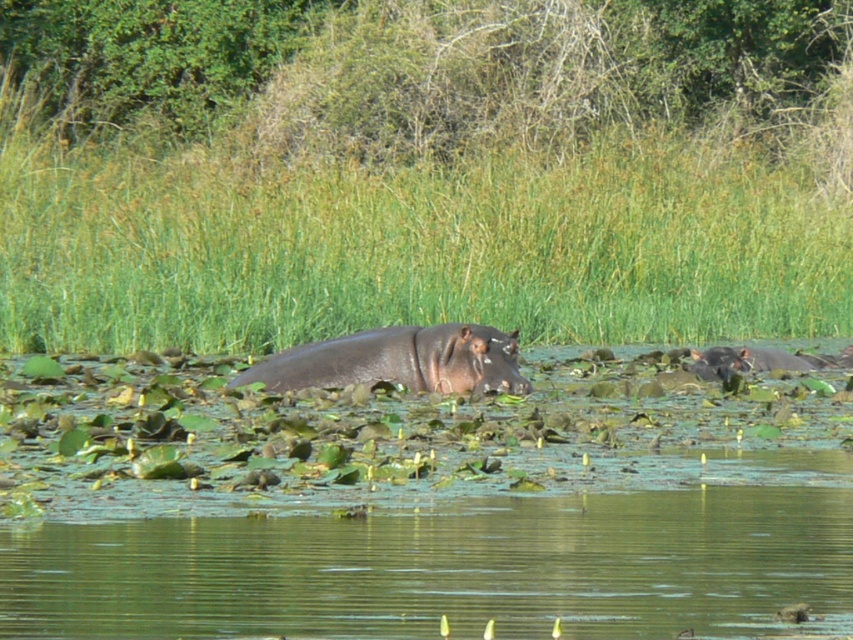
You are a photographer trying to capture the green grass at center and the sleek dark brown hippo at center in a single shot. Considering their sizes, which one will occupy more space in your photo?

The green grass at center has a larger size compared to the sleek dark brown hippo at center, so it will occupy more space in the photo.

You are a drone operator flying over a natural reserve. Your drone is currently at the point marked by point (447,568). You need to hover above the greenish water at center. Is your current position correct?

Yes, the point (447,568) marks greenish water at center, so the drone is already hovering above the correct location.